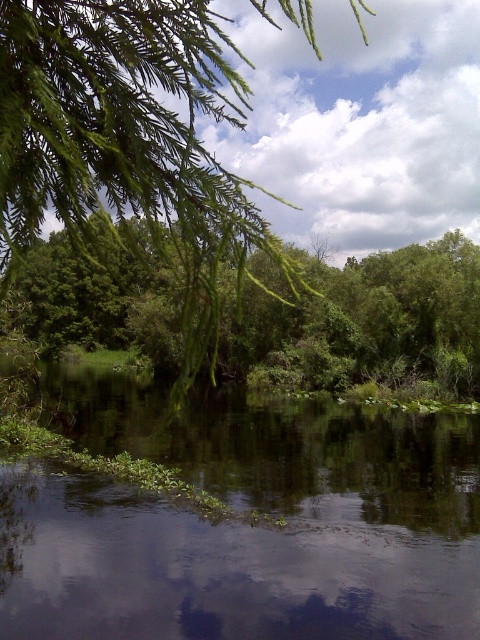
Measure the distance between green leafy vegetation at center and green leafy branch at upper left.

green leafy vegetation at center is 60.80 feet from green leafy branch at upper left.

Is green leafy vegetation at center to the right of green leafy branch at upper left from the viewer's perspective?

In fact, green leafy vegetation at center is to the left of green leafy branch at upper left.

Where is `green leafy vegetation at center`? This screenshot has height=640, width=480. green leafy vegetation at center is located at coordinates (244, 524).

The height and width of the screenshot is (640, 480). Find the location of `green leafy vegetation at center`. green leafy vegetation at center is located at coordinates (244, 524).

Is green leafy vegetation at center taller than green leafy tree at center?

No.

Who is positioned more to the right, green leafy vegetation at center or green leafy tree at center?

green leafy vegetation at center is more to the right.

Is point (72, 493) positioned in front of point (257, 362)?

Yes.

The height and width of the screenshot is (640, 480). What are the coordinates of `green leafy vegetation at center` in the screenshot? It's located at [x=244, y=524].

Which of these two, green leafy branch at upper left or green leafy tree at center, stands shorter?

Standing shorter between the two is green leafy tree at center.

Which of these two, green leafy branch at upper left or green leafy tree at center, stands taller?

green leafy branch at upper left

You are a GUI agent. You are given a task and a screenshot of the screen. Output one action in this format:
    pyautogui.click(x=<x>, y=<y>)
    Task: Click on the green leafy branch at upper left
    The image size is (480, 640).
    Given the screenshot: What is the action you would take?
    pyautogui.click(x=129, y=144)

Where is `green leafy branch at upper left`? This screenshot has height=640, width=480. green leafy branch at upper left is located at coordinates (129, 144).